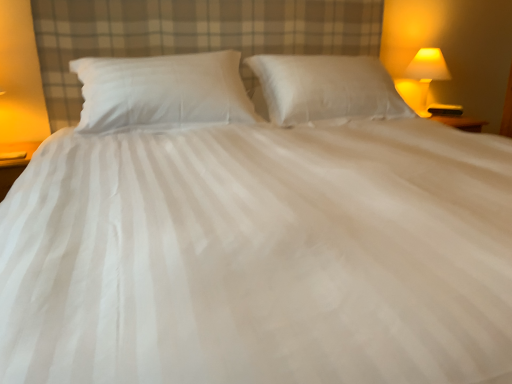
Question: Considering the positions of white soft pillow at center, which appears as the second pillow when viewed from the left, and white cotton pillow at center, the 2th pillow from the right, in the image, is white soft pillow at center, which appears as the second pillow when viewed from the left, bigger or smaller than white cotton pillow at center, the 2th pillow from the right,?

Choices:
 (A) big
 (B) small

Answer: (A)

Question: Considering the positions of white soft pillow at center, the 1th pillow in the right-to-left sequence, and white cotton pillow at center, the 2th pillow from the right, in the image, is white soft pillow at center, the 1th pillow in the right-to-left sequence, wider or thinner than white cotton pillow at center, the 2th pillow from the right,?

Choices:
 (A) wide
 (B) thin

Answer: (B)

Question: Estimate the real-world distances between objects in this image. Which object is closer to the white soft pillow at center, which appears as the second pillow when viewed from the left?

Choices:
 (A) white cotton pillow at center, the 1th pillow when ordered from left to right
 (B) matte yellow glass lamp at upper right

Answer: (A)

Question: Which object is the farthest from the white cotton pillow at center, the 2th pillow from the right?

Choices:
 (A) matte yellow glass lamp at upper right
 (B) white soft pillow at center, which appears as the second pillow when viewed from the left

Answer: (A)